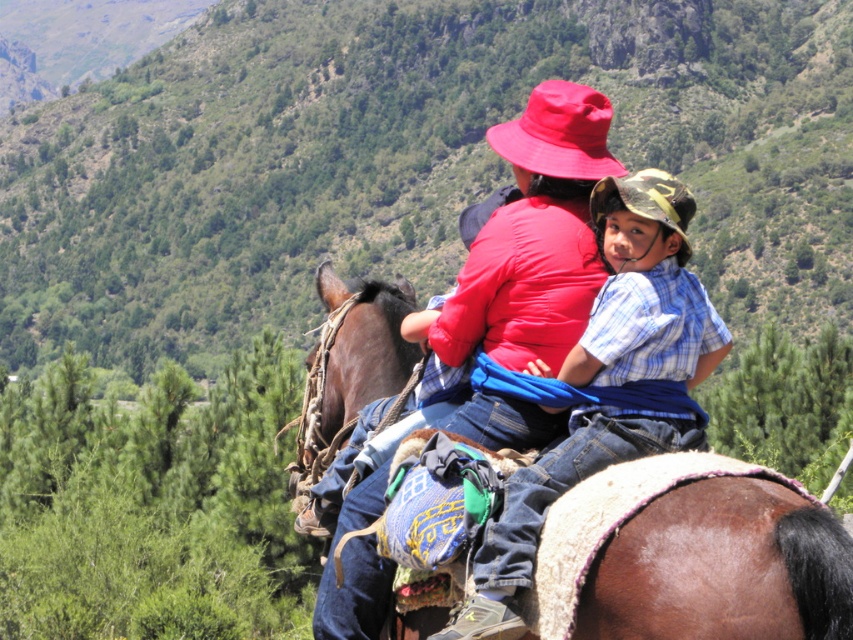
Is blue plaid shirt at center to the right of camouflage fabric cowboy hat at upper center from the viewer's perspective?

Incorrect, blue plaid shirt at center is not on the right side of camouflage fabric cowboy hat at upper center.

Can you confirm if blue plaid shirt at center is smaller than camouflage fabric cowboy hat at upper center?

Yes.

Where is `blue plaid shirt at center`? The width and height of the screenshot is (853, 640). blue plaid shirt at center is located at coordinates (608, 384).

Locate an element on the screen. Image resolution: width=853 pixels, height=640 pixels. blue plaid shirt at center is located at coordinates (608, 384).

Is point (619, 230) behind point (495, 132)?

No.

Measure the distance between blue plaid shirt at center and red fabric cowboy hat at upper center.

blue plaid shirt at center and red fabric cowboy hat at upper center are 22.68 feet apart from each other.

What do you see at coordinates (608, 384) in the screenshot?
I see `blue plaid shirt at center` at bounding box center [608, 384].

Where is `blue plaid shirt at center`? Image resolution: width=853 pixels, height=640 pixels. blue plaid shirt at center is located at coordinates (608, 384).

Based on the photo, who is positioned more to the left, red fabric cowboy hat at upper center or camouflage fabric cowboy hat at upper center?

red fabric cowboy hat at upper center is more to the left.

What do you see at coordinates (560, 132) in the screenshot?
I see `red fabric cowboy hat at upper center` at bounding box center [560, 132].

Image resolution: width=853 pixels, height=640 pixels. What do you see at coordinates (560, 132) in the screenshot? I see `red fabric cowboy hat at upper center` at bounding box center [560, 132].

The width and height of the screenshot is (853, 640). What are the coordinates of `red fabric cowboy hat at upper center` in the screenshot? It's located at (560, 132).